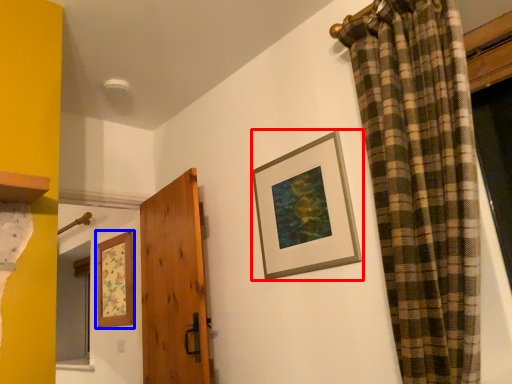
Question: Which point is closer to the camera, picture frame (highlighted by a red box) or picture frame (highlighted by a blue box)?

Choices:
 (A) picture frame
 (B) picture frame

Answer: (A)